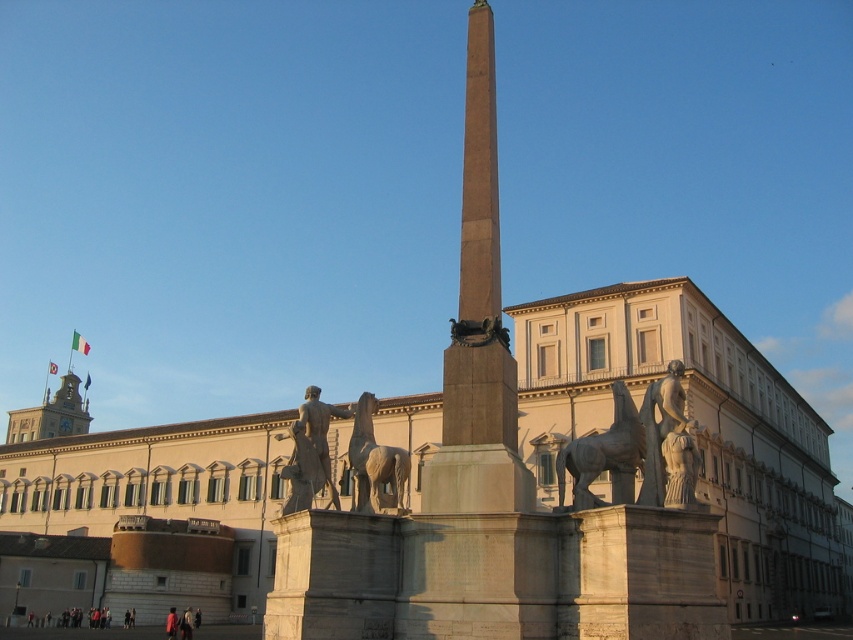
Who is taller, white stone building at center or polished bronze horse at center-right?

white stone building at center is taller.

Looking at this image, is white stone building at center in front of polished bronze horse at center-right?

Yes, it is.

Does point (9, 509) lie behind point (630, 497)?

That is True.

At what (x,y) coordinates should I click in order to perform the action: click on white stone building at center. Please return your answer as a coordinate pair (x, y). This screenshot has width=853, height=640. Looking at the image, I should click on (698, 433).

Is the position of polished bronze statue at center more distant than that of metallic clock tower at upper left?

That is False.

Between point (300, 406) and point (80, 396), which one is positioned behind?

The point (80, 396) is behind.

Is point (329, 404) less distant than point (53, 422)?

Yes, it is in front of point (53, 422).

You are a GUI agent. You are given a task and a screenshot of the screen. Output one action in this format:
    pyautogui.click(x=<x>, y=<y>)
    Task: Click on the polished bronze statue at center
    The height and width of the screenshot is (640, 853).
    Given the screenshot: What is the action you would take?
    pyautogui.click(x=310, y=452)

Does polished bronze horse at center-right have a lesser height compared to polished bronze statue at center?

Indeed, polished bronze horse at center-right has a lesser height compared to polished bronze statue at center.

Which of these two, polished bronze horse at center-right or polished bronze statue at center, stands shorter?

polished bronze horse at center-right is shorter.

Locate an element on the screen. The height and width of the screenshot is (640, 853). polished bronze horse at center-right is located at coordinates (604, 456).